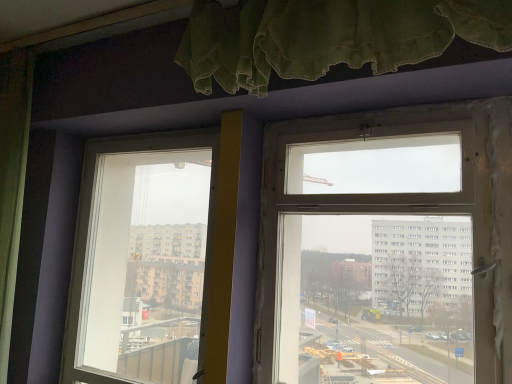
This screenshot has width=512, height=384. In order to click on transparent glass window at center, positioned as the 2th window in right-to-left order in this screenshot , I will do `click(122, 248)`.

Describe the element at coordinates (122, 248) in the screenshot. I see `transparent glass window at center, acting as the second window starting from the front` at that location.

Locate an element on the screen. The height and width of the screenshot is (384, 512). clear glass window at upper center, which is the 2th window in left-to-right order is located at coordinates (383, 246).

The height and width of the screenshot is (384, 512). What do you see at coordinates (383, 246) in the screenshot?
I see `clear glass window at upper center, which is the 2th window in left-to-right order` at bounding box center [383, 246].

Find the location of `transparent glass window at center, positioned as the 2th window in right-to-left order`. transparent glass window at center, positioned as the 2th window in right-to-left order is located at coordinates (122, 248).

Considering the relative positions of clear glass window at upper center, which ranks as the 1th window in front-to-back order, and transparent glass window at center, positioned as the first window in back-to-front order, in the image provided, is clear glass window at upper center, which ranks as the 1th window in front-to-back order, to the right of transparent glass window at center, positioned as the first window in back-to-front order, from the viewer's perspective?

Indeed, clear glass window at upper center, which ranks as the 1th window in front-to-back order, is positioned on the right side of transparent glass window at center, positioned as the first window in back-to-front order.

Relative to transparent glass window at center, positioned as the first window in back-to-front order, is clear glass window at upper center, which is the 2th window in left-to-right order, in front or behind?

Visually, clear glass window at upper center, which is the 2th window in left-to-right order, is located in front of transparent glass window at center, positioned as the first window in back-to-front order.

Considering the positions of point (473, 203) and point (98, 219), is point (473, 203) closer or farther from the camera than point (98, 219)?

Point (473, 203).

Consider the image. From the image's perspective, is clear glass window at upper center, which ranks as the 1th window in front-to-back order, on top of transparent glass window at center, marked as the first window in a left-to-right arrangement?

Yes, from the image's perspective, clear glass window at upper center, which ranks as the 1th window in front-to-back order, is above transparent glass window at center, marked as the first window in a left-to-right arrangement.

From a real-world perspective, is clear glass window at upper center, which is the 2th window in left-to-right order, under transparent glass window at center, marked as the first window in a left-to-right arrangement?

No, from a real-world perspective, clear glass window at upper center, which is the 2th window in left-to-right order, is not under transparent glass window at center, marked as the first window in a left-to-right arrangement.

Considering the sizes of objects clear glass window at upper center, acting as the 2th window starting from the back, and transparent glass window at center, positioned as the 2th window in right-to-left order, in the image provided, who is thinner, clear glass window at upper center, acting as the 2th window starting from the back, or transparent glass window at center, positioned as the 2th window in right-to-left order,?

With smaller width is clear glass window at upper center, acting as the 2th window starting from the back.

Who is shorter, clear glass window at upper center, acting as the 2th window starting from the back, or transparent glass window at center, acting as the second window starting from the front?

Standing shorter between the two is clear glass window at upper center, acting as the 2th window starting from the back.

Considering the sizes of objects clear glass window at upper center, acting as the 2th window starting from the back, and transparent glass window at center, acting as the second window starting from the front, in the image provided, who is bigger, clear glass window at upper center, acting as the 2th window starting from the back, or transparent glass window at center, acting as the second window starting from the front,?

transparent glass window at center, acting as the second window starting from the front, is bigger.

Is clear glass window at upper center, which is the 1th window from right to left, surrounding transparent glass window at center, acting as the second window starting from the front?

No, transparent glass window at center, acting as the second window starting from the front, is not a part of clear glass window at upper center, which is the 1th window from right to left.

Is clear glass window at upper center, which ranks as the 1th window in front-to-back order, not near transparent glass window at center, positioned as the first window in back-to-front order?

They are positioned close to each other.

Is clear glass window at upper center, which is the 1th window from right to left, facing away from transparent glass window at center, positioned as the 2th window in right-to-left order?

No, clear glass window at upper center, which is the 1th window from right to left, is not facing the opposite direction of transparent glass window at center, positioned as the 2th window in right-to-left order.

From the picture: How distant is clear glass window at upper center, which is the 1th window from right to left, from transparent glass window at center, positioned as the 2th window in right-to-left order?

A distance of 27.19 inches exists between clear glass window at upper center, which is the 1th window from right to left, and transparent glass window at center, positioned as the 2th window in right-to-left order.

Image resolution: width=512 pixels, height=384 pixels. Find the location of `window behind the clear glass window at upper center, acting as the 2th window starting from the back`. window behind the clear glass window at upper center, acting as the 2th window starting from the back is located at coordinates (122, 248).

Does transparent glass window at center, acting as the second window starting from the front, appear on the left side of clear glass window at upper center, which is the 2th window in left-to-right order?

Yes, transparent glass window at center, acting as the second window starting from the front, is to the left of clear glass window at upper center, which is the 2th window in left-to-right order.

Which object is further away from the camera, transparent glass window at center, acting as the second window starting from the front, or clear glass window at upper center, which is the 2th window in left-to-right order?

Positioned behind is transparent glass window at center, acting as the second window starting from the front.

Is point (141, 142) behind point (340, 206)?

That is True.

From the image's perspective, is transparent glass window at center, positioned as the 2th window in right-to-left order, on clear glass window at upper center, which is the 2th window in left-to-right order?

Actually, transparent glass window at center, positioned as the 2th window in right-to-left order, appears below clear glass window at upper center, which is the 2th window in left-to-right order, in the image.

From a real-world perspective, which is physically below, transparent glass window at center, marked as the first window in a left-to-right arrangement, or clear glass window at upper center, which is the 2th window in left-to-right order?

transparent glass window at center, marked as the first window in a left-to-right arrangement, from a real-world perspective.

Which of these two, transparent glass window at center, marked as the first window in a left-to-right arrangement, or clear glass window at upper center, which ranks as the 1th window in front-to-back order, is thinner?

With smaller width is clear glass window at upper center, which ranks as the 1th window in front-to-back order.

Which of these two, transparent glass window at center, marked as the first window in a left-to-right arrangement, or clear glass window at upper center, which ranks as the 1th window in front-to-back order, stands taller?

transparent glass window at center, marked as the first window in a left-to-right arrangement, is taller.

Which of these two, transparent glass window at center, positioned as the first window in back-to-front order, or clear glass window at upper center, which is the 1th window from right to left, is bigger?

With larger size is transparent glass window at center, positioned as the first window in back-to-front order.

Is transparent glass window at center, positioned as the 2th window in right-to-left order, spatially inside clear glass window at upper center, which ranks as the 1th window in front-to-back order, or outside of it?

transparent glass window at center, positioned as the 2th window in right-to-left order, exists outside the volume of clear glass window at upper center, which ranks as the 1th window in front-to-back order.

Is transparent glass window at center, marked as the first window in a left-to-right arrangement, positioned far away from clear glass window at upper center, which ranks as the 1th window in front-to-back order?

transparent glass window at center, marked as the first window in a left-to-right arrangement, is near clear glass window at upper center, which ranks as the 1th window in front-to-back order, not far away.

Is clear glass window at upper center, which is the 1th window from right to left, at the back of transparent glass window at center, marked as the first window in a left-to-right arrangement?

No.

Can you tell me how much transparent glass window at center, positioned as the first window in back-to-front order, and clear glass window at upper center, acting as the 2th window starting from the back, differ in facing direction?

There is a 0.000683-degree angle between the facing directions of transparent glass window at center, positioned as the first window in back-to-front order, and clear glass window at upper center, acting as the 2th window starting from the back.

Measure the distance from transparent glass window at center, acting as the second window starting from the front, to clear glass window at upper center, acting as the 2th window starting from the back.

transparent glass window at center, acting as the second window starting from the front, is 27.19 inches away from clear glass window at upper center, acting as the 2th window starting from the back.

Locate an element on the screen. This screenshot has width=512, height=384. window on the left of clear glass window at upper center, which is the 2th window in left-to-right order is located at coordinates [x=122, y=248].

Image resolution: width=512 pixels, height=384 pixels. What are the coordinates of `window located above the transparent glass window at center, marked as the first window in a left-to-right arrangement (from the image's perspective)` in the screenshot? It's located at (383, 246).

Find the location of a particular element. window in front of the transparent glass window at center, positioned as the first window in back-to-front order is located at coordinates (383, 246).